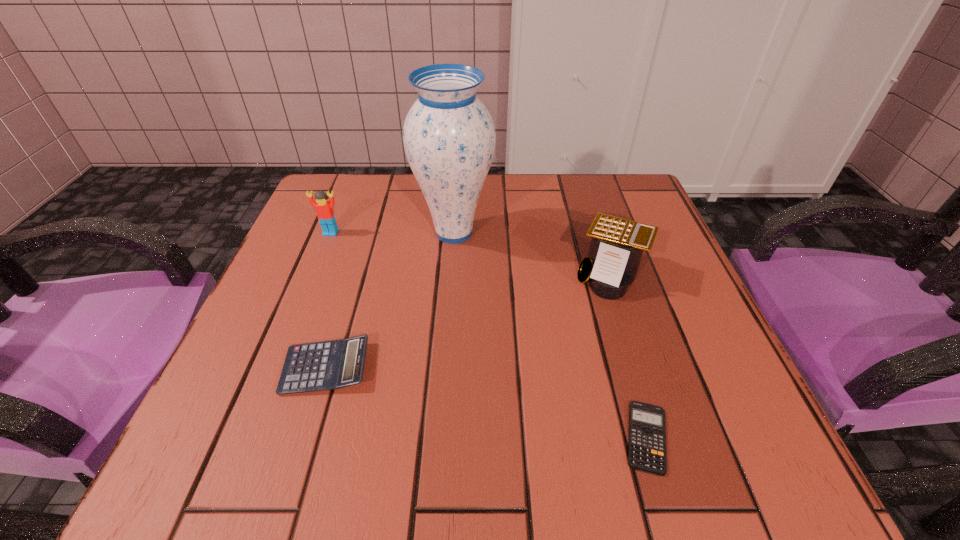
This screenshot has height=540, width=960. Identify the location of vase. (449, 137).

You are a GUI agent. You are given a task and a screenshot of the screen. Output one action in this format:
    pyautogui.click(x=<x>, y=<y>)
    Task: Click on the third object from right to left
    
    Given the screenshot: What is the action you would take?
    pyautogui.click(x=449, y=137)

Where is `the farthest calculator`? The image size is (960, 540). the farthest calculator is located at coordinates click(617, 244).

You are a GUI agent. You are given a task and a screenshot of the screen. Output one action in this format:
    pyautogui.click(x=<x>, y=<y>)
    Task: Click on the Lego
    
    Given the screenshot: What is the action you would take?
    pyautogui.click(x=324, y=208)

Locate an element on the screen. the fourth farthest object is located at coordinates (328, 365).

The height and width of the screenshot is (540, 960). Find the location of `the second shortest object`. the second shortest object is located at coordinates (328, 365).

Find the location of a particular element. the shortest object is located at coordinates (647, 440).

The image size is (960, 540). I want to click on the shortest calculator, so click(647, 440).

You are a GUI agent. You are given a task and a screenshot of the screen. Output one action in this format:
    pyautogui.click(x=<x>, y=<y>)
    Task: Click on the vacant position located 0.190m on the left of the tallest object
    Image resolution: width=960 pixels, height=540 pixels.
    Given the screenshot: What is the action you would take?
    pyautogui.click(x=329, y=233)

At what (x,y) coordinates should I click in order to perform the action: click on free space located on the left of the farthest calculator. Please return your answer as a coordinate pair (x, y). Looking at the image, I should click on (537, 275).